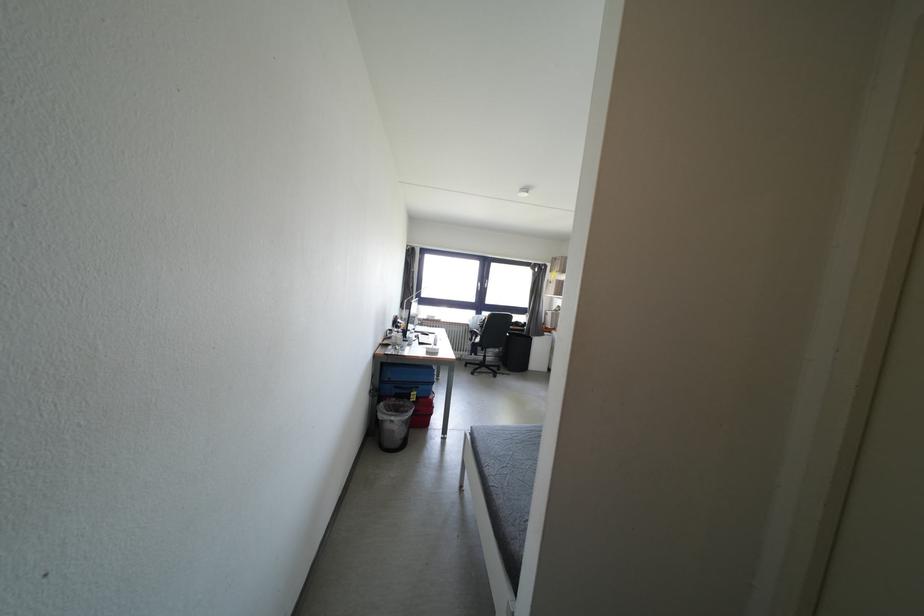
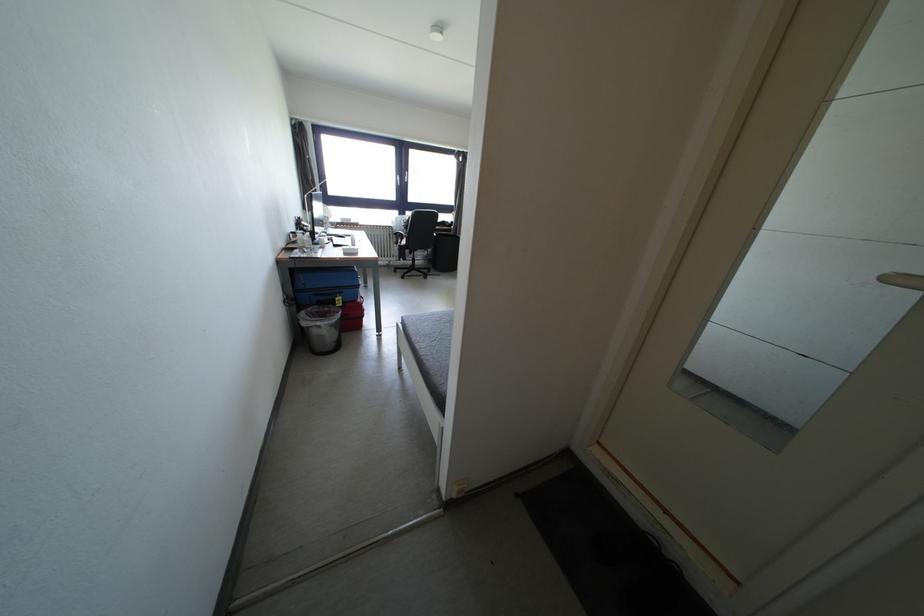
In the second image, find the point that corresponds to [477,331] in the first image.

(400, 233)